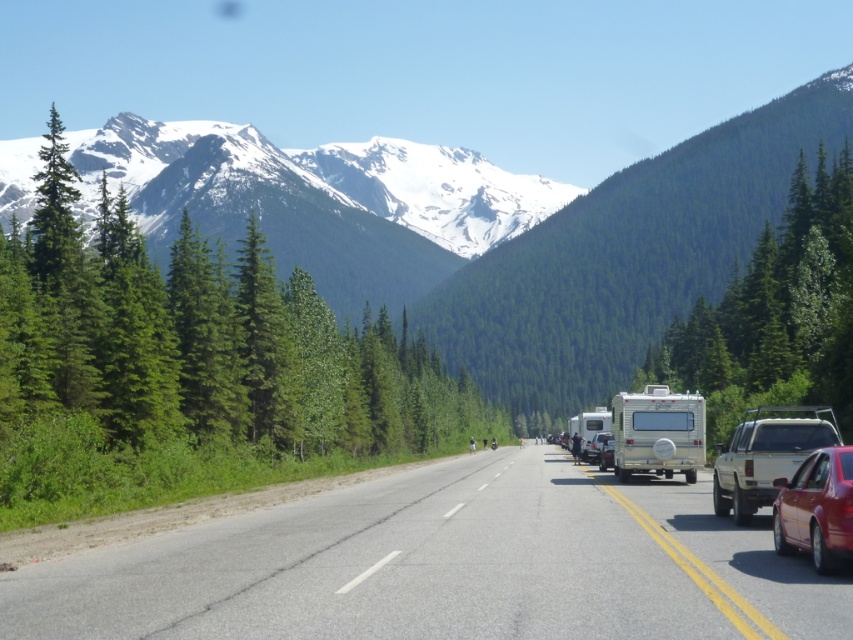
Question: Can you confirm if asphalt road at center is smaller than metallic silver car at center-right?

Choices:
 (A) no
 (B) yes

Answer: (A)

Question: Among these objects, which one is nearest to the camera?

Choices:
 (A) silver metallic trailer truck at right
 (B) white glossy camper van at center-right
 (C) green matte tree at upper center
 (D) asphalt road at center

Answer: (D)

Question: Which of the following is the closest to the observer?

Choices:
 (A) (592, 419)
 (B) (606, 433)
 (C) (55, 632)

Answer: (C)

Question: In this image, where is silver metallic trailer truck at right located relative to metallic silver car at center?

Choices:
 (A) above
 (B) below

Answer: (B)

Question: Does shiny red sedan at lower right appear under white glossy camper van at center-right?

Choices:
 (A) yes
 (B) no

Answer: (B)

Question: Which object appears closest to the camera in this image?

Choices:
 (A) white matte camper van at right
 (B) silver metallic trailer truck at right

Answer: (A)